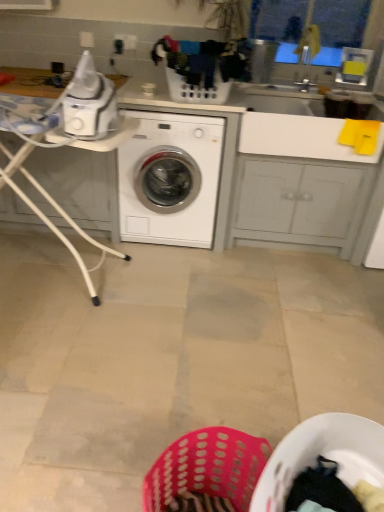
I want to click on transparent plastic window screen at upper right, so click(338, 27).

I want to click on white plastic laundry basket at center, so click(197, 89).

Find the location of `white glossy washing machine at center`. white glossy washing machine at center is located at coordinates (170, 179).

From a real-world perspective, is white plastic laundry basket at center physically below white glossy washing machine at center?

Actually, white plastic laundry basket at center is physically above white glossy washing machine at center in the real world.

Between white plastic laundry basket at center and white glossy washing machine at center, which one has larger size?

Bigger between the two is white glossy washing machine at center.

Is white plastic laundry basket at center taller than white glossy washing machine at center?

Incorrect, the height of white plastic laundry basket at center is not larger of that of white glossy washing machine at center.

Find the location of a particular element. Image resolution: width=384 pixels, height=512 pixels. washing machine behind the white plastic laundry basket at center is located at coordinates (170, 179).

You are a GUI agent. You are given a task and a screenshot of the screen. Output one action in this format:
    pyautogui.click(x=<x>, y=<y>)
    Task: Click on the window screen on the right of white plastic laundry basket at center
    The width and height of the screenshot is (384, 512).
    Given the screenshot: What is the action you would take?
    pyautogui.click(x=338, y=27)

Which is behind, point (180, 77) or point (343, 9)?

The point (343, 9) is more distant.

What's the angular difference between white plastic laundry basket at center and transparent plastic window screen at upper right's facing directions?

white plastic laundry basket at center and transparent plastic window screen at upper right are facing 0.258 degrees away from each other.

Is white plastic table at left at the back of white glossy washing machine at center?

No.

Do you think white glossy washing machine at center is within white plastic table at left, or outside of it?

white glossy washing machine at center exists outside the volume of white plastic table at left.

Is white glossy washing machine at center thinner than white plastic table at left?

In fact, white glossy washing machine at center might be wider than white plastic table at left.

From a real-world perspective, relative to white plastic laundry basket at center, is white plastic table at left vertically above or below?

Clearly, from a real-world perspective, white plastic table at left is below white plastic laundry basket at center.

Identify the location of table that is under the white plastic laundry basket at center (from a real-world perspective). The image size is (384, 512). (55, 209).

Considering the sizes of white plastic table at left and white plastic laundry basket at center in the image, is white plastic table at left bigger or smaller than white plastic laundry basket at center?

white plastic table at left is bigger than white plastic laundry basket at center.

Is white plastic table at left facing away from white plastic laundry basket at center?

That's not correct — white plastic table at left is not looking away from white plastic laundry basket at center.

Is white plastic table at left taller than white glossy counter top at upper left?

Yes.

Where is `table on the left of white glossy counter top at upper left`? table on the left of white glossy counter top at upper left is located at coordinates (55, 209).

In the scene shown: Visually, is white plastic table at left positioned to the left or to the right of white glossy counter top at upper left?

Clearly, white plastic table at left is on the left of white glossy counter top at upper left in the image.

Does white glossy washing machine at center come behind white glossy counter top at upper left?

No, white glossy washing machine at center is closer to the camera.

Is point (165, 165) positioned behind point (320, 204)?

No, it is not.

In order to click on counter top on the left of white glossy washing machine at center in this screenshot , I will do `click(284, 177)`.

In terms of size, does white glossy washing machine at center appear bigger or smaller than white glossy counter top at upper left?

In the image, white glossy washing machine at center appears to be smaller than white glossy counter top at upper left.

From the picture: Is white glossy counter top at upper left positioned with its back to white plastic laundry basket at center?

No, white glossy counter top at upper left is not facing the opposite direction of white plastic laundry basket at center.

Relative to white plastic laundry basket at center, is white glossy counter top at upper left in front or behind?

Visually, white glossy counter top at upper left is located behind white plastic laundry basket at center.

Is white glossy counter top at upper left far from white plastic laundry basket at center?

No, white glossy counter top at upper left is in close proximity to white plastic laundry basket at center.

Consider the image. Which object is thinner, white glossy counter top at upper left or white plastic laundry basket at center?

white plastic laundry basket at center.

The height and width of the screenshot is (512, 384). I want to click on washing machine behind the white plastic laundry basket at center, so click(x=170, y=179).

Find the location of a particular element. window screen above the white plastic laundry basket at center (from the image's perspective) is located at coordinates (338, 27).

From the image, which object appears to be farther from white glossy washing machine at center, white plastic table at left or white glossy counter top at upper left?

white plastic table at left.

From the image, which object appears to be farther from white plastic laundry basket at center, transparent plastic window screen at upper right or white glossy washing machine at center?

transparent plastic window screen at upper right lies further to white plastic laundry basket at center than the other object.

Which object lies further to the anchor point white plastic table at left, white plastic laundry basket at center or transparent plastic window screen at upper right?

Based on the image, transparent plastic window screen at upper right appears to be further to white plastic table at left.

Looking at the image, which one is located closer to white glossy washing machine at center, transparent plastic window screen at upper right or white glossy counter top at upper left?

Among the two, white glossy counter top at upper left is located nearer to white glossy washing machine at center.

When comparing their distances from transparent plastic window screen at upper right, does white plastic laundry basket at center or white glossy washing machine at center seem closer?

white plastic laundry basket at center.

In the scene shown: From the image, which object appears to be nearer to transparent plastic window screen at upper right, white glossy washing machine at center or white glossy counter top at upper left?

white glossy counter top at upper left lies closer to transparent plastic window screen at upper right than the other object.

From the image, which object appears to be nearer to white glossy counter top at upper left, white plastic table at left or white plastic laundry basket at center?

A: white plastic laundry basket at center is closer to white glossy counter top at upper left.

Looking at the image, which one is located closer to white glossy washing machine at center, white glossy counter top at upper left or white plastic table at left?

The object closer to white glossy washing machine at center is white glossy counter top at upper left.

Where is `counter top between white plastic table at left and transparent plastic window screen at upper right`? Image resolution: width=384 pixels, height=512 pixels. counter top between white plastic table at left and transparent plastic window screen at upper right is located at coordinates (284, 177).

The height and width of the screenshot is (512, 384). What are the coordinates of `washing machine between white glossy counter top at upper left and transparent plastic window screen at upper right from left to right` in the screenshot? It's located at (170, 179).

Identify the location of washing machine located between white plastic table at left and transparent plastic window screen at upper right in the left-right direction. The height and width of the screenshot is (512, 384). (170, 179).

Identify the location of basket between white glossy washing machine at center and transparent plastic window screen at upper right. The image size is (384, 512). pos(197,89).